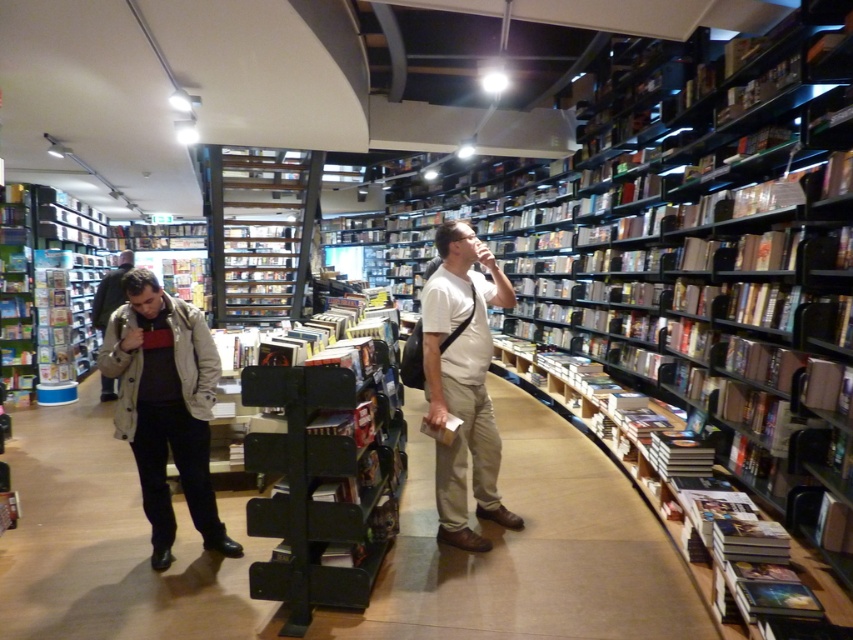
You are a customer in the bookstore and you want to reach the metallic silver shelves at center from the white matte shirt at center. Which direction should you move?

You should move to the left to reach the metallic silver shelves at center since the white matte shirt at center is to the right of them.

You are standing in the bookstore and want to take a photo of the white matte shirt at center. Your camera is 10.06 feet away from the shirt. Is the distance sufficient to capture the entire shirt in the photo?

The distance between the white matte shirt at center and the camera is exactly 10.06 feet, which is sufficient to capture the entire shirt in the photo as the camera can focus at that distance.

You are standing at the entrance of the bookstore and see a white matte shirt at center in the middle of the store. If you walk straight towards it, how far will you have to walk to reach it?

The white matte shirt at center is 3.07 meters away from the camera, so you will need to walk 3.07 meters to reach it.